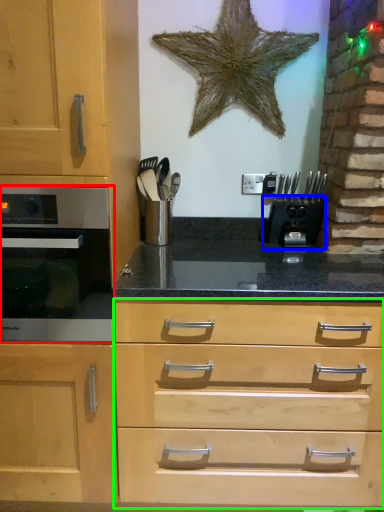
Question: Estimate the real-world distances between objects in this image. Which object is farther from oven (highlighted by a red box), coffee machine (highlighted by a blue box) or drawer (highlighted by a green box)?

Choices:
 (A) coffee machine
 (B) drawer

Answer: (A)